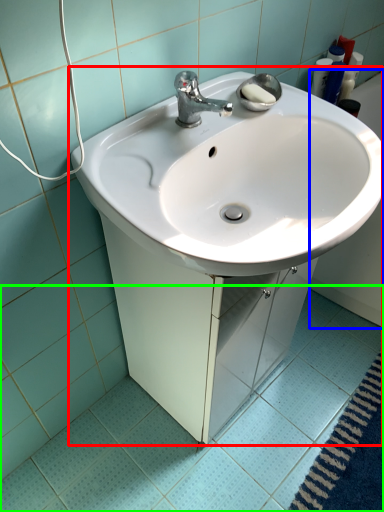
Question: Based on their relative distances, which object is farther from sink (highlighted by a red box)? Choose from bath (highlighted by a blue box) and ceramic tile (highlighted by a green box).

Choices:
 (A) bath
 (B) ceramic tile

Answer: (A)